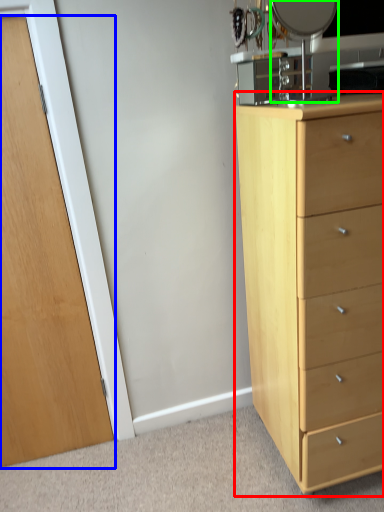
Question: Based on their relative distances, which object is farther from chest of drawers (highlighted by a red box)? Choose from door (highlighted by a blue box) and mirror (highlighted by a green box).

Choices:
 (A) door
 (B) mirror

Answer: (A)